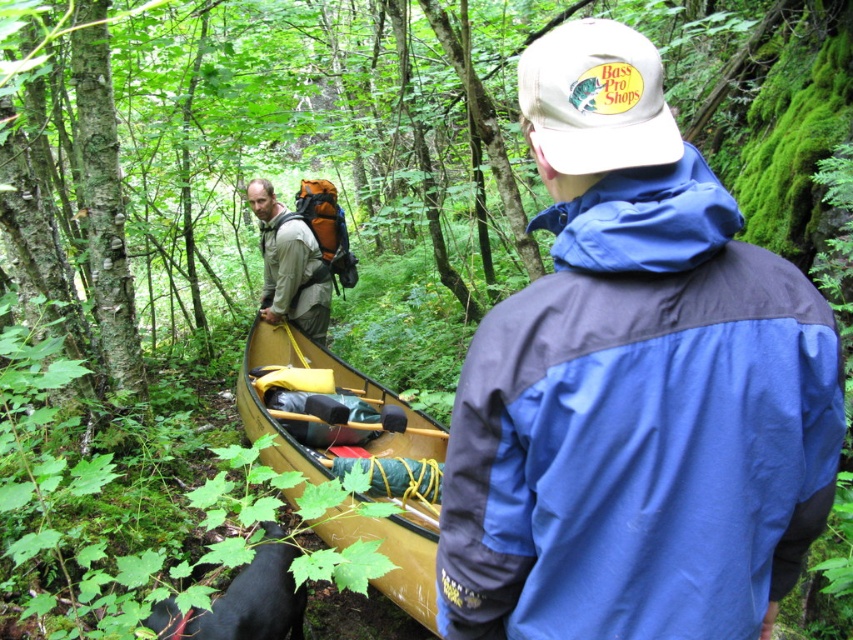
You are planning to launch the wooden canoe at center from the forest clearing. Based on its position, which direction should you aim to move it towards to reach the nearest water body?

The wooden canoe at center is located at point (351, 454), so you should move it towards the direction indicated by this coordinate to reach the nearest water body.

You are navigating through a dense forest and come across a canoeing expedition scene. There is a point marked at coordinates (634, 387). What object is located at this point?

The point at coordinates (634, 387) marks the blue fabric jacket at center.

You are a hiker who needs to retrieve your yellow plastic paddle at center from the wooden canoe at center. Which object do you need to approach first?

You need to approach the wooden canoe at center first because it is closer to you than the yellow plastic paddle at center.